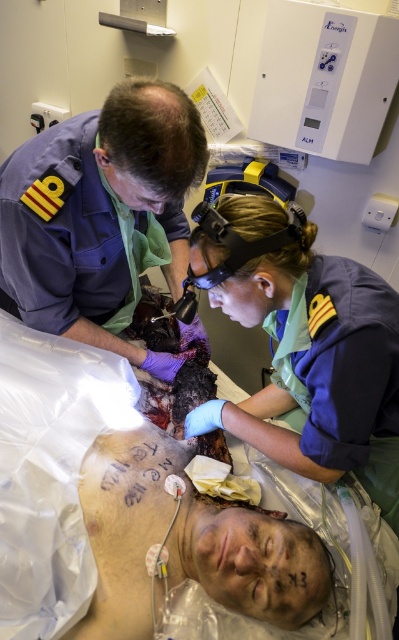
Is blue uniform at center to the right of purple uniform at upper left from the viewer's perspective?

Indeed, blue uniform at center is positioned on the right side of purple uniform at upper left.

Measure the distance between blue uniform at center and camera.

They are 38.30 inches apart.

Is point (256, 250) in front of point (136, 289)?

Yes, it is.

You are a GUI agent. You are given a task and a screenshot of the screen. Output one action in this format:
    pyautogui.click(x=<x>, y=<y>)
    Task: Click on the blue uniform at center
    This screenshot has height=640, width=399.
    Given the screenshot: What is the action you would take?
    pyautogui.click(x=304, y=346)